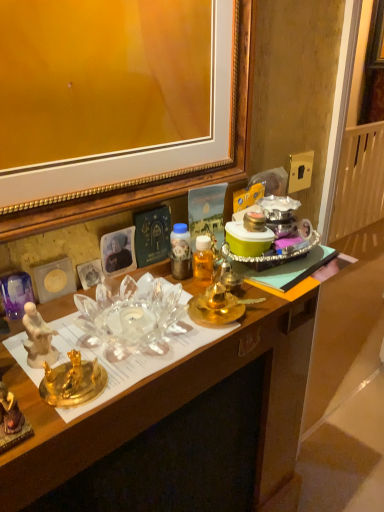
Question: Relative to transparent glass bowl at center, is gold metallic power outlet at upper right in front or behind?

Choices:
 (A) front
 (B) behind

Answer: (B)

Question: Looking at the image, does gold metallic power outlet at upper right seem bigger or smaller compared to transparent glass bowl at center?

Choices:
 (A) small
 (B) big

Answer: (A)

Question: Estimate the real-world distances between objects in this image. Which object is closer to the white porcelain plate at left?

Choices:
 (A) gold metallic power outlet at upper right
 (B) transparent glass bowl at center

Answer: (B)

Question: Which of these objects is positioned farthest from the white porcelain plate at left?

Choices:
 (A) gold metallic power outlet at upper right
 (B) transparent glass bowl at center

Answer: (A)